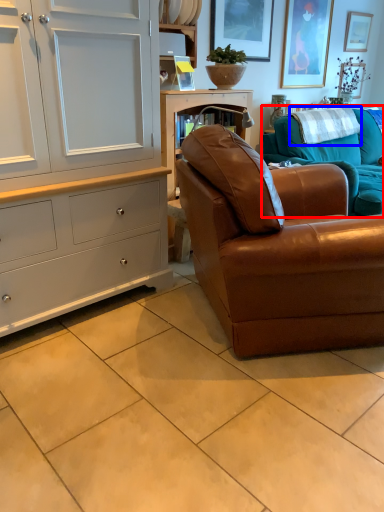
Question: Which object appears closest to the camera in this image, studio couch (highlighted by a red box) or blanket (highlighted by a blue box)?

Choices:
 (A) studio couch
 (B) blanket

Answer: (A)